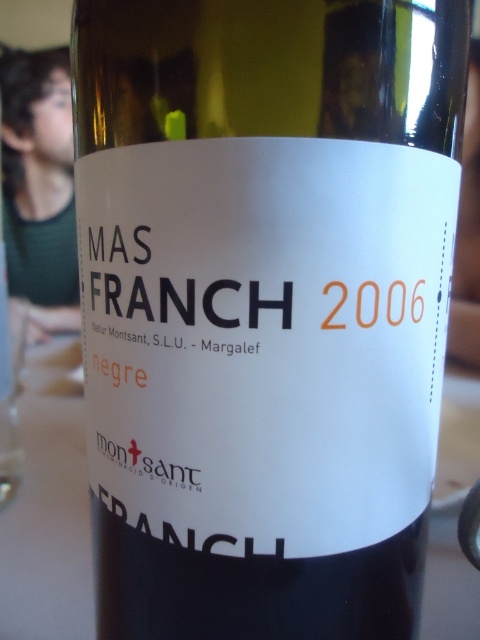
You are examining the wine bottle label and notice two points marked on it. The first point is at coordinates point (433,602) and the second is at point (48,166). Which point is closer to you when looking at the label?

Point (433,602) is closer to the viewer than point (48,166).

You are a graphic designer reviewing a wine label design. The label has a white background with black and orange text. There is a point marked at coordinates (48,508). Where is this point located in relation to the label?

The point at coordinates (48,508) is located on the white paper label at the center.